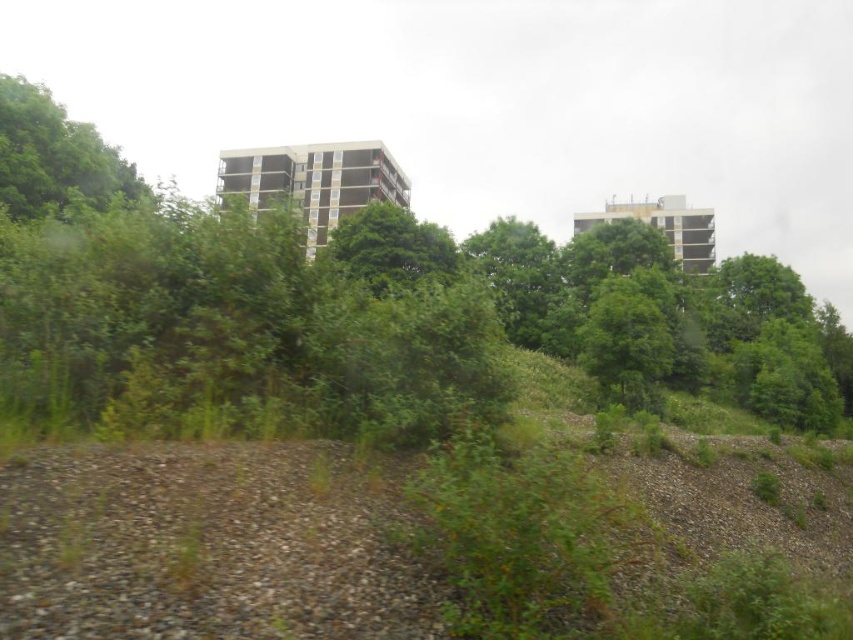
Question: Which point is farther to the camera?

Choices:
 (A) pos(32,365)
 (B) pos(109,200)

Answer: (B)

Question: Is the position of green leafy tree at upper center more distant than that of green leafy tree at upper left?

Choices:
 (A) no
 (B) yes

Answer: (A)

Question: Among these points, which one is nearest to the camera?

Choices:
 (A) (55, 148)
 (B) (717, 317)

Answer: (A)

Question: Can you confirm if green leafy tree at upper center is wider than green leafy tree at upper left?

Choices:
 (A) no
 (B) yes

Answer: (B)

Question: Can you confirm if green leafy tree at upper center is thinner than green leafy tree at upper left?

Choices:
 (A) yes
 (B) no

Answer: (B)

Question: Which point is closer to the camera?

Choices:
 (A) (51, 106)
 (B) (59, 120)

Answer: (A)